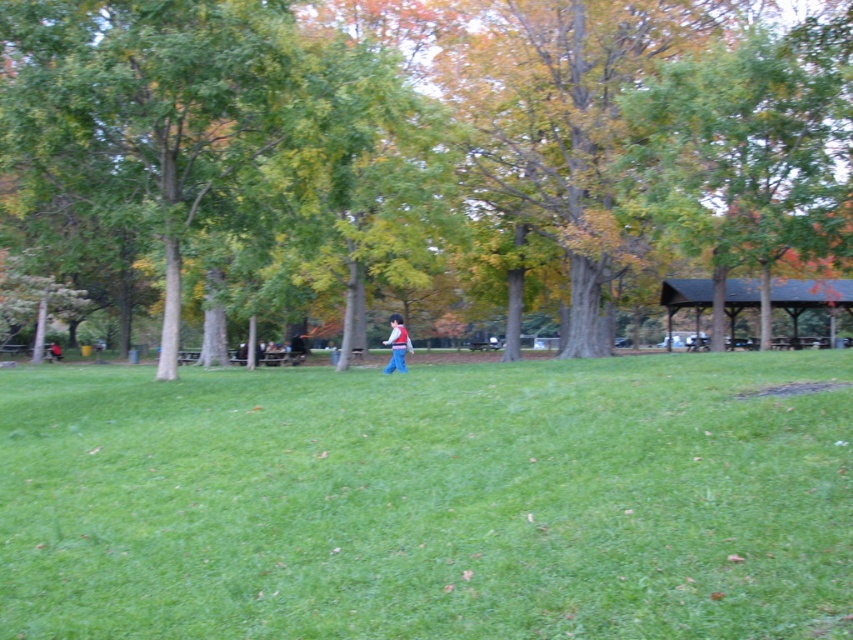
You are standing at the origin point in the park, and you want to find the green leafy tree at center. Which direction should you go to reach it?

The green leafy tree at center is located at coordinates 0.214 on the x and 0.509 on the y. Since you are at the origin, you should move in the positive x and positive y direction to reach it.

You are standing in the park and want to take a photo of the green grassy field at center and the green leafy tree at center. Which object should you focus on first if you want to capture both in one shot without moving the camera?

The green grassy field at center is shorter than the green leafy tree at center, so you should focus on the green grassy field at center first to ensure both are in focus.